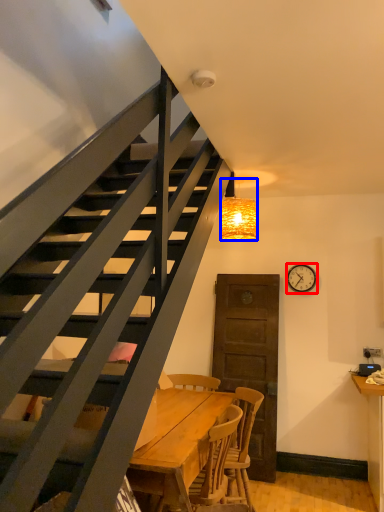
Question: Which object is further to the camera taking this photo, clock (highlighted by a red box) or lamp (highlighted by a blue box)?

Choices:
 (A) clock
 (B) lamp

Answer: (A)